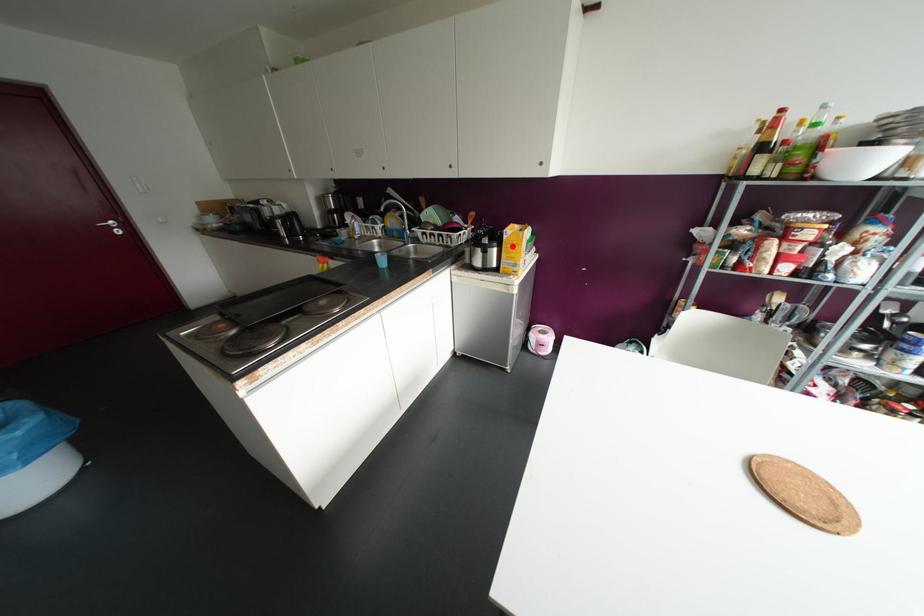
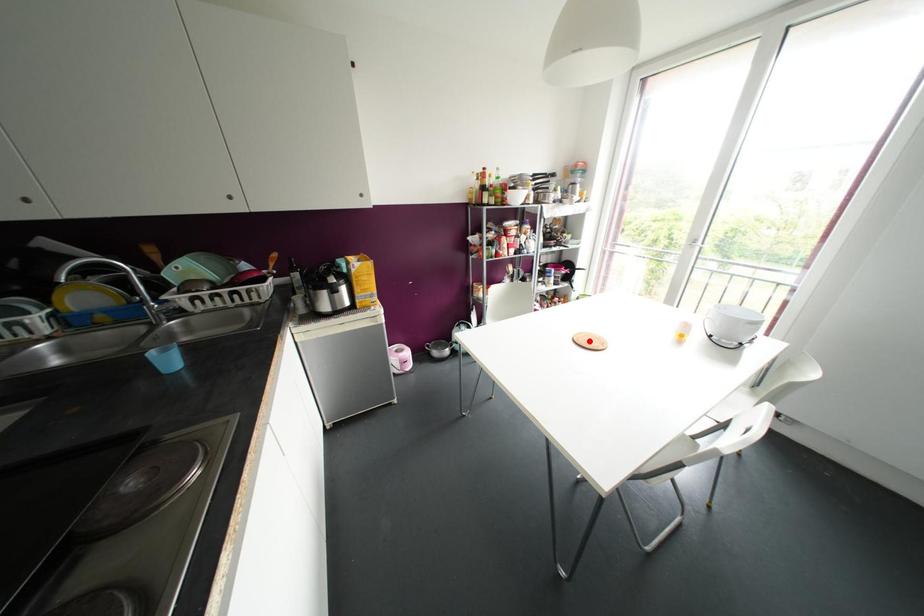
I am providing you with two images of the same scene from different viewpoints. A red point is marked on the first image and another point is marked on the second image. Is the marked point in image1 the same physical position as the marked point in image2?

No